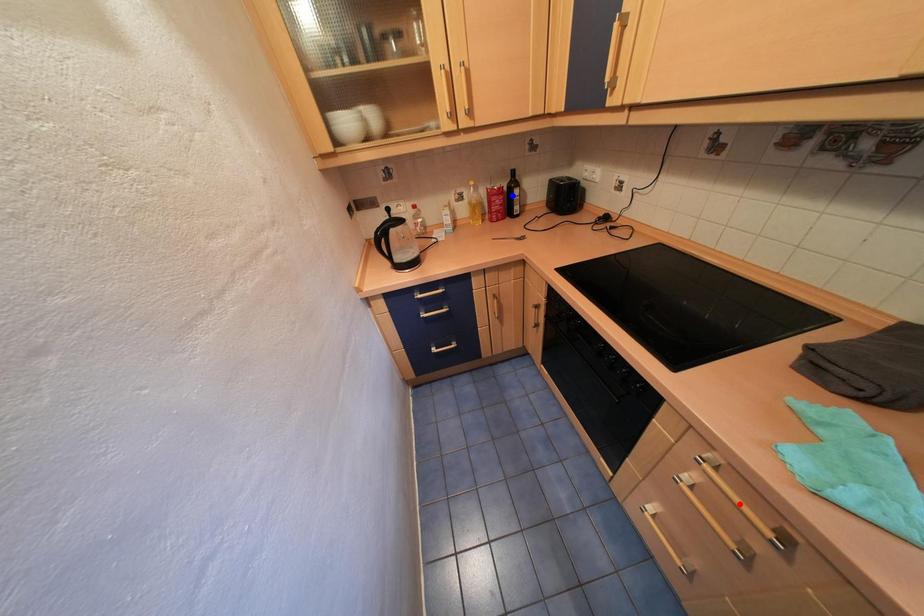
Question: Two points are marked on the image. Which point is closer to the camera?

Choices:
 (A) Blue point is closer.
 (B) Red point is closer.

Answer: (B)